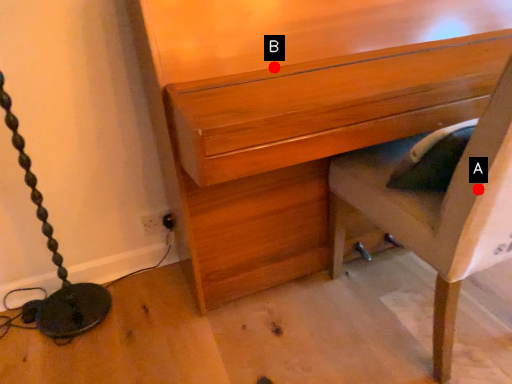
Question: Two points are circled on the image, labeled by A and B beside each circle. Among these points, which one is farthest from the camera?

Choices:
 (A) A is further
 (B) B is further

Answer: (B)